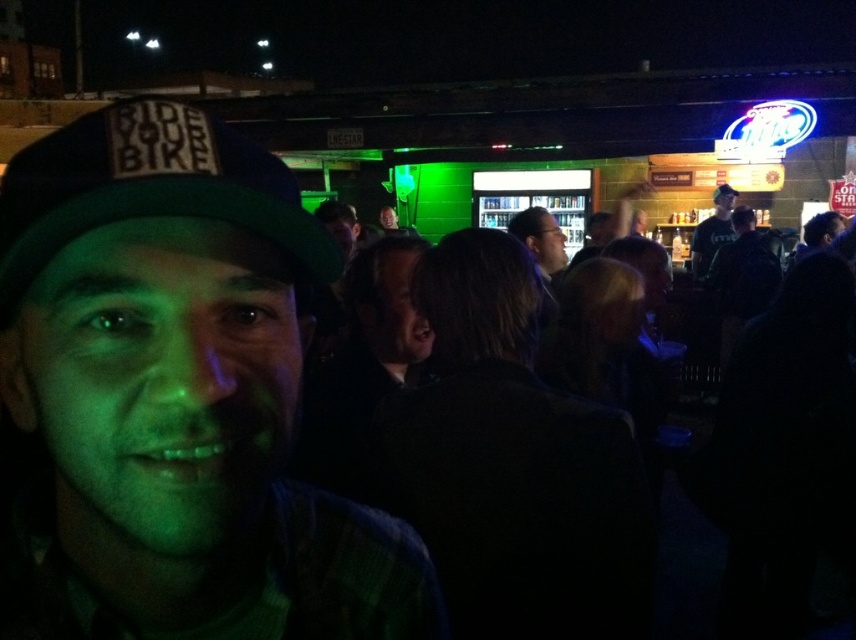
Between green fabric cap at upper left and green fabric cap at center, which one appears on the right side from the viewer's perspective?

Positioned to the right is green fabric cap at center.

Which is in front, point (201, 128) or point (726, 182)?

Point (201, 128) is more forward.

Where is `green fabric cap at upper left`? The width and height of the screenshot is (856, 640). green fabric cap at upper left is located at coordinates (147, 186).

Between matte green cap at center and green fabric cap at center, which one is positioned lower?

matte green cap at center is lower down.

Can you confirm if matte green cap at center is shorter than green fabric cap at center?

No.

Who is more forward, (209, 552) or (724, 182)?

Positioned in front is point (209, 552).

This screenshot has height=640, width=856. In order to click on matte green cap at center in this screenshot , I will do `click(176, 396)`.

Is matte green cap at center shorter than dark clothing at center?

Yes.

Which is more to the right, matte green cap at center or dark clothing at center?

matte green cap at center

What do you see at coordinates (176, 396) in the screenshot? I see `matte green cap at center` at bounding box center [176, 396].

The height and width of the screenshot is (640, 856). Find the location of `matte green cap at center`. matte green cap at center is located at coordinates (176, 396).